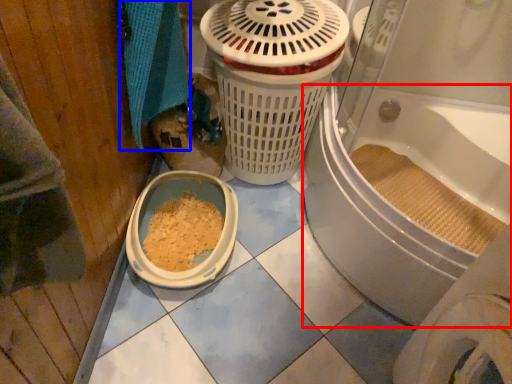
Question: Which of the following is the farthest to the observer, bath (highlighted by a red box) or bath towel (highlighted by a blue box)?

Choices:
 (A) bath
 (B) bath towel

Answer: (B)